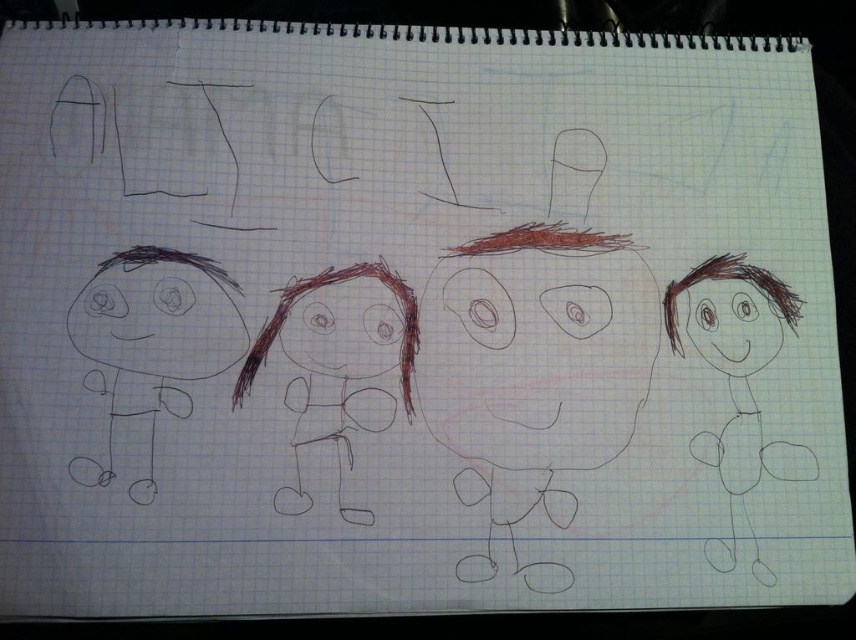
From the picture: Is brown sketchy stick figure at right taller than brown scribbled hair at center?

Correct, brown sketchy stick figure at right is much taller as brown scribbled hair at center.

Is brown sketchy stick figure at right shorter than brown scribbled hair at center?

In fact, brown sketchy stick figure at right may be taller than brown scribbled hair at center.

This screenshot has height=640, width=856. Identify the location of brown sketchy stick figure at right. (736, 384).

Can you confirm if brown scribbled figure at left is bigger than brown scribbled hair at center?

Actually, brown scribbled figure at left might be smaller than brown scribbled hair at center.

Who is shorter, brown scribbled figure at left or brown scribbled hair at center?

brown scribbled figure at left

Which is behind, point (128, 372) or point (391, 397)?

Positioned behind is point (391, 397).

The width and height of the screenshot is (856, 640). I want to click on brown scribbled figure at left, so click(150, 348).

Is brown scribbled figure at left to the left of brown sketchy stick figure at right from the viewer's perspective?

Indeed, brown scribbled figure at left is positioned on the left side of brown sketchy stick figure at right.

Is brown scribbled figure at left shorter than brown sketchy stick figure at right?

Indeed, brown scribbled figure at left has a lesser height compared to brown sketchy stick figure at right.

This screenshot has height=640, width=856. What do you see at coordinates (150, 348) in the screenshot?
I see `brown scribbled figure at left` at bounding box center [150, 348].

The width and height of the screenshot is (856, 640). In order to click on brown scribbled figure at left in this screenshot , I will do `click(150, 348)`.